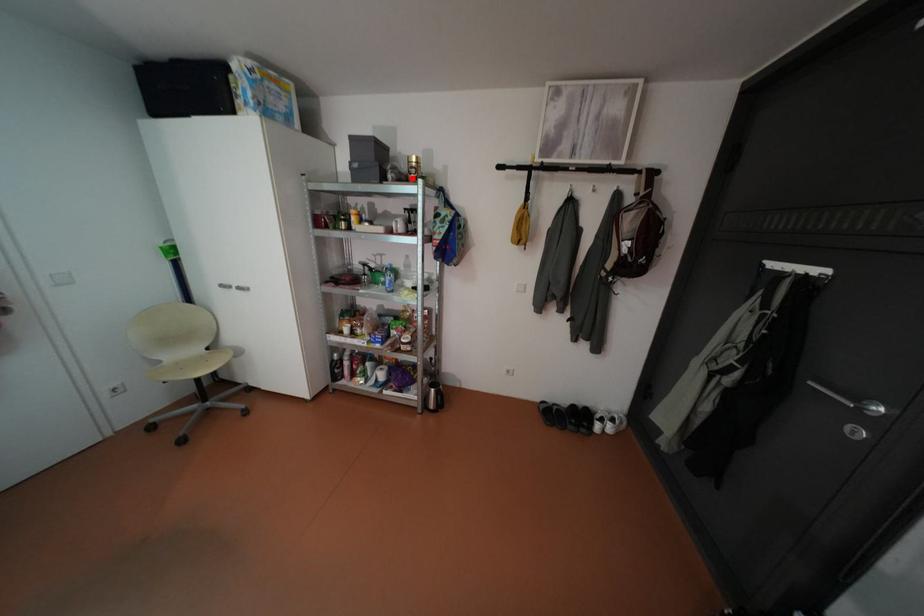
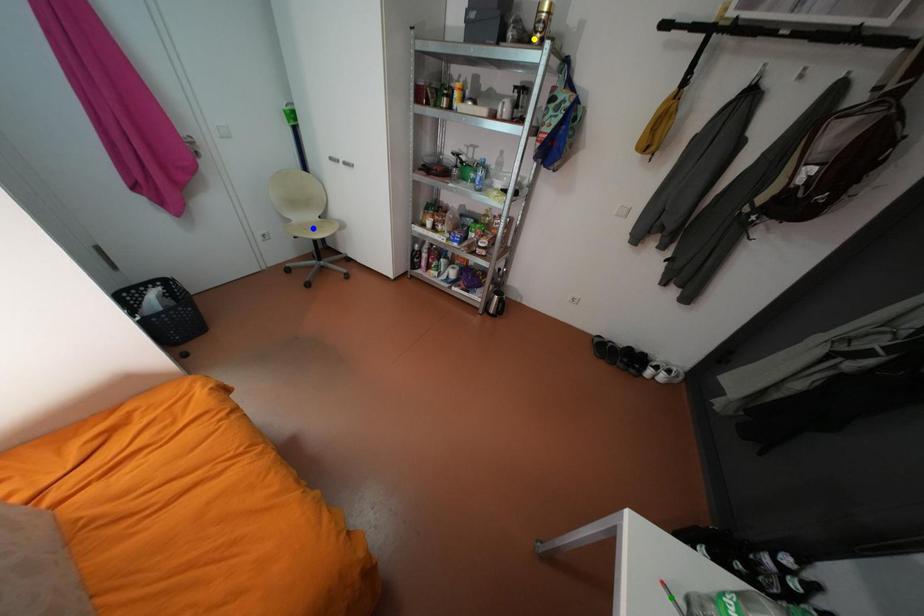
Question: I am providing you with two images of the same scene from different viewpoints. A red point is marked on the first image. You are given multiple points on the second image. Which point in image 2 is actually the same real-world point as the red point in image 1?

Choices:
 (A) blue point
 (B) green point
 (C) yellow point

Answer: (C)